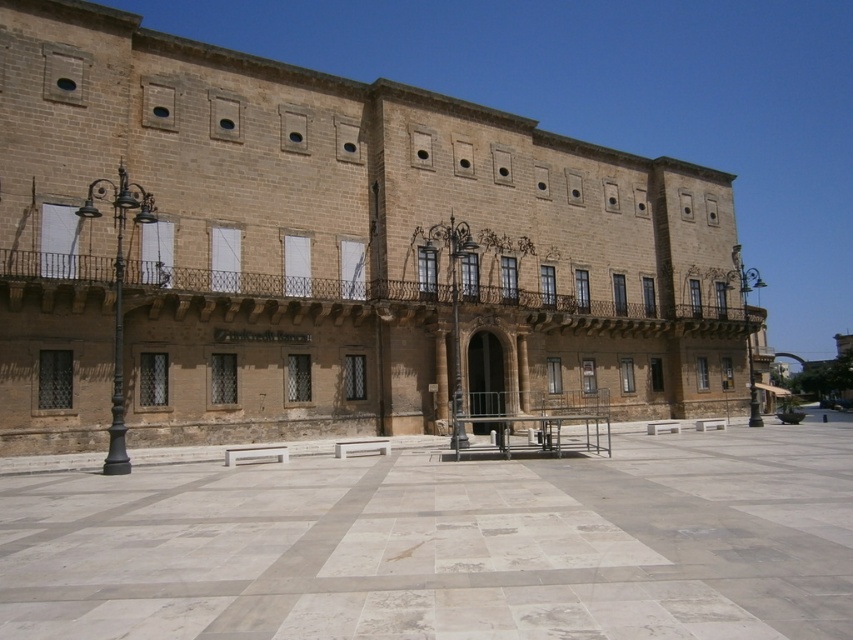
Is marble tiles at center wider than matte stone square at upper center?

Yes.

Who is more distant from viewer, (184, 387) or (149, 106)?

The point (149, 106) is behind.

At what (x,y) coordinates should I click in order to perform the action: click on marble tiles at center. Please return your answer as a coordinate pair (x, y). Image resolution: width=853 pixels, height=640 pixels. Looking at the image, I should click on (331, 252).

Looking at this image, does marble tiles at center have a lesser width compared to matte stone square at upper left?

In fact, marble tiles at center might be wider than matte stone square at upper left.

Where is `marble tiles at center`? This screenshot has width=853, height=640. marble tiles at center is located at coordinates (331, 252).

Locate an element on the screen. This screenshot has height=640, width=853. marble tiles at center is located at coordinates (331, 252).

Is matte stone square at upper left above matte stone square at upper center?

Correct, matte stone square at upper left is located above matte stone square at upper center.

Image resolution: width=853 pixels, height=640 pixels. Identify the location of matte stone square at upper left. (62, 77).